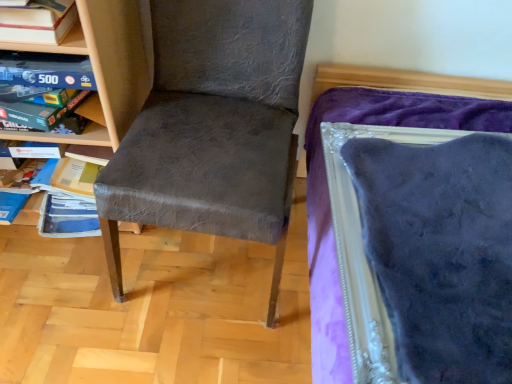
Question: Considering the positions of wooden board game at upper left, which ranks as the 1th shelf in back-to-front order, and matte gray chair at center in the image, is wooden board game at upper left, which ranks as the 1th shelf in back-to-front order, wider or thinner than matte gray chair at center?

Choices:
 (A) thin
 (B) wide

Answer: (A)

Question: Is wooden board game at upper left, the second shelf positioned from the front, taller or shorter than matte gray chair at center?

Choices:
 (A) short
 (B) tall

Answer: (A)

Question: Estimate the real-world distances between objects in this image. Which object is closer to the wooden board game at upper left, the second shelf positioned from the front?

Choices:
 (A) wooden bookshelf at left, which is counted as the first shelf, starting from the front
 (B) matte gray chair at center

Answer: (A)

Question: Estimate the real-world distances between objects in this image. Which object is farther from the wooden bookshelf at left, which is counted as the 2th shelf, starting from the back?

Choices:
 (A) wooden board game at upper left, which ranks as the 1th shelf in back-to-front order
 (B) matte gray chair at center

Answer: (B)